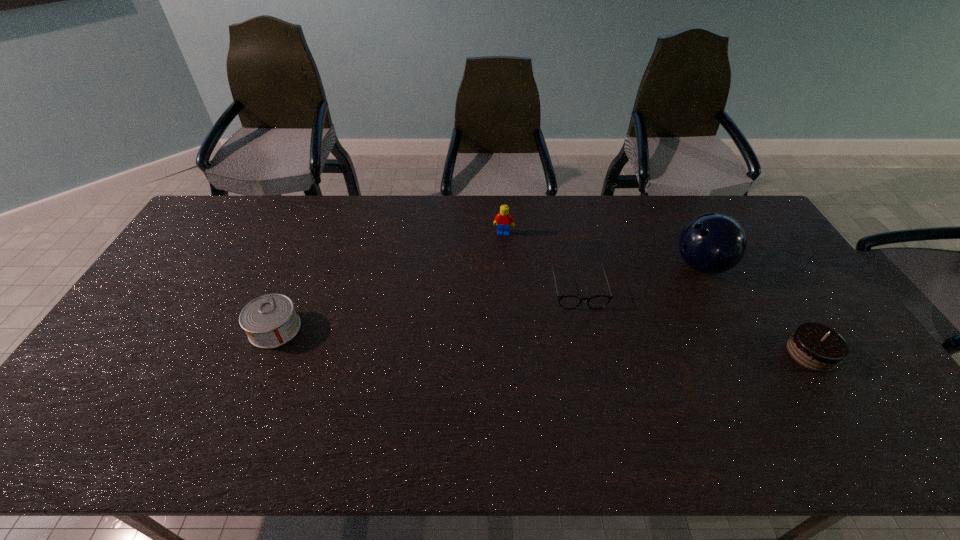
The height and width of the screenshot is (540, 960). Find the location of `the leftmost object`. the leftmost object is located at coordinates (270, 321).

At what (x,y) coordinates should I click in order to perform the action: click on the fourth tallest object. Please return your answer as a coordinate pair (x, y). The height and width of the screenshot is (540, 960). Looking at the image, I should click on (270, 321).

What are the coordinates of `the third shortest object` in the screenshot? It's located at (814, 346).

Identify the location of the rightmost object. 814,346.

Locate an element on the screen. the shortest object is located at coordinates (567, 301).

Identify the location of spectacles. The image size is (960, 540). (567, 301).

The image size is (960, 540). Identify the location of bowling ball. (712, 243).

You are a GUI agent. You are given a task and a screenshot of the screen. Output one action in this format:
    pyautogui.click(x=<x>, y=<y>)
    Task: Click on the second object from right to left
    The image size is (960, 540).
    Given the screenshot: What is the action you would take?
    tap(712, 243)

Where is `the fourth object from right to left`? This screenshot has height=540, width=960. the fourth object from right to left is located at coordinates (503, 219).

Locate an element on the screen. the farthest object is located at coordinates (503, 219).